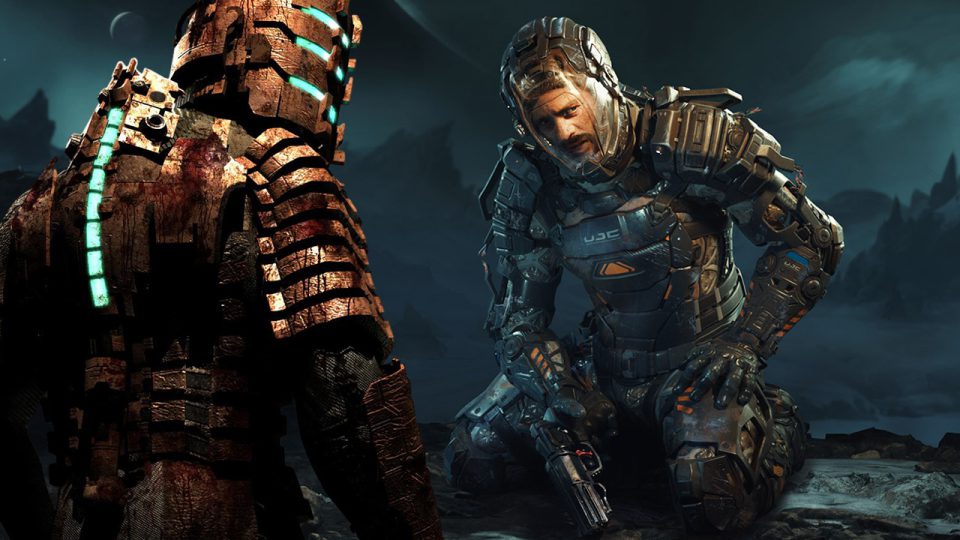
Identify the location of blue lights. (120, 117), (106, 131), (105, 150), (96, 211), (90, 242), (98, 290), (100, 264), (306, 90), (318, 58), (326, 19).